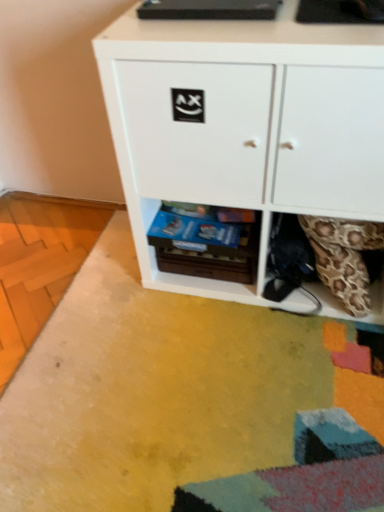
This screenshot has width=384, height=512. What are the coordinates of `vacant area on top of white matte cabinet at center (from a real-world perspective)` in the screenshot? It's located at (267, 23).